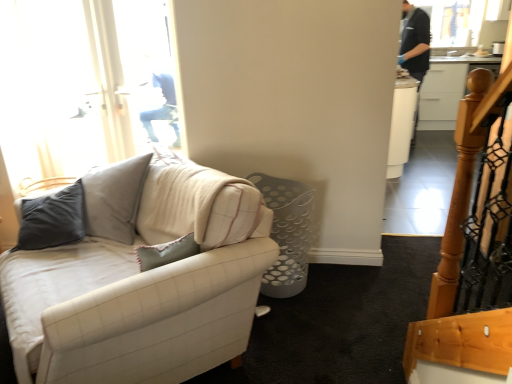
Describe the element at coordinates (441, 95) in the screenshot. This screenshot has width=512, height=384. I see `white glossy cabinet at upper right` at that location.

In order to click on white glossy cabinet at upper right in this screenshot , I will do `click(441, 95)`.

Describe the element at coordinates (141, 278) in the screenshot. This screenshot has height=384, width=512. I see `white fabric couch at left` at that location.

What are the coordinates of `white fabric couch at left` in the screenshot? It's located at point(141,278).

At what (x,y) coordinates should I click in order to perform the action: click on white glossy cabinet at upper right. Please return your answer as a coordinate pair (x, y). Image resolution: width=512 pixels, height=384 pixels. Looking at the image, I should click on (441, 95).

Considering the relative positions of white fabric couch at left and white glossy cabinet at upper right in the image provided, is white fabric couch at left to the right of white glossy cabinet at upper right from the viewer's perspective?

Incorrect, white fabric couch at left is not on the right side of white glossy cabinet at upper right.

Which object is more forward, white fabric couch at left or white glossy cabinet at upper right?

white fabric couch at left is more forward.

Between point (145, 156) and point (431, 98), which one is positioned in front?

The point (145, 156) is more forward.

From the image's perspective, which object appears higher, white fabric couch at left or white glossy cabinet at upper right?

white glossy cabinet at upper right, from the image's perspective.

From a real-world perspective, is white fabric couch at left located beneath white glossy cabinet at upper right?

Actually, white fabric couch at left is physically above white glossy cabinet at upper right in the real world.

Between white fabric couch at left and white glossy cabinet at upper right, which one has smaller width?

white glossy cabinet at upper right.

From their relative heights in the image, would you say white fabric couch at left is taller or shorter than white glossy cabinet at upper right?

Considering their sizes, white fabric couch at left has less height than white glossy cabinet at upper right.

Can you confirm if white fabric couch at left is bigger than white glossy cabinet at upper right?

Indeed, white fabric couch at left has a larger size compared to white glossy cabinet at upper right.

Is white fabric couch at left not within white glossy cabinet at upper right?

Indeed, white fabric couch at left is completely outside white glossy cabinet at upper right.

Does white fabric couch at left touch white glossy cabinet at upper right?

No, white fabric couch at left is not in contact with white glossy cabinet at upper right.

Is white fabric couch at left looking in the opposite direction of white glossy cabinet at upper right?

Absolutely, white fabric couch at left is directed away from white glossy cabinet at upper right.

Measure the distance from white fabric couch at left to white glossy cabinet at upper right.

A distance of 4.61 meters exists between white fabric couch at left and white glossy cabinet at upper right.

In order to click on cabinetry on the right of white fabric couch at left in this screenshot , I will do `click(441, 95)`.

Considering the positions of objects white glossy cabinet at upper right and white fabric couch at left in the image provided, who is more to the left, white glossy cabinet at upper right or white fabric couch at left?

white fabric couch at left.

Who is more distant, white glossy cabinet at upper right or white fabric couch at left?

white glossy cabinet at upper right is further away from the camera.

Considering the points (426, 87) and (257, 266), which point is behind, point (426, 87) or point (257, 266)?

The point (426, 87) is farther.

From the image's perspective, which one is positioned lower, white glossy cabinet at upper right or white fabric couch at left?

white fabric couch at left appears lower in the image.

From a real-world perspective, is white glossy cabinet at upper right positioned above or below white fabric couch at left?

From a real-world perspective, white glossy cabinet at upper right is physically below white fabric couch at left.

Considering the relative sizes of white glossy cabinet at upper right and white fabric couch at left in the image provided, is white glossy cabinet at upper right wider than white fabric couch at left?

In fact, white glossy cabinet at upper right might be narrower than white fabric couch at left.

Is white glossy cabinet at upper right shorter than white fabric couch at left?

No, white glossy cabinet at upper right is not shorter than white fabric couch at left.

Considering the sizes of objects white glossy cabinet at upper right and white fabric couch at left in the image provided, who is bigger, white glossy cabinet at upper right or white fabric couch at left?

With larger size is white fabric couch at left.

Which is correct: white glossy cabinet at upper right is inside white fabric couch at left, or outside of it?

white glossy cabinet at upper right exists outside the volume of white fabric couch at left.

Is white glossy cabinet at upper right far from white fabric couch at left?

Yes, white glossy cabinet at upper right and white fabric couch at left are located far from each other.

Could you tell me if white glossy cabinet at upper right is turned towards white fabric couch at left?

No, white glossy cabinet at upper right does not turn towards white fabric couch at left.

Can you tell me how much white glossy cabinet at upper right and white fabric couch at left differ in facing direction?

The facing directions of white glossy cabinet at upper right and white fabric couch at left are 47.8 degrees apart.

At what (x,y) coordinates should I click in order to perform the action: click on cabinetry behind the white fabric couch at left. Please return your answer as a coordinate pair (x, y). The image size is (512, 384). Looking at the image, I should click on (441, 95).

Locate an element on the screen. Image resolution: width=512 pixels, height=384 pixels. cabinetry below the white fabric couch at left (from a real-world perspective) is located at coordinates (441, 95).

Find the location of a particular element. The height and width of the screenshot is (384, 512). cabinetry that is behind the white fabric couch at left is located at coordinates (441, 95).